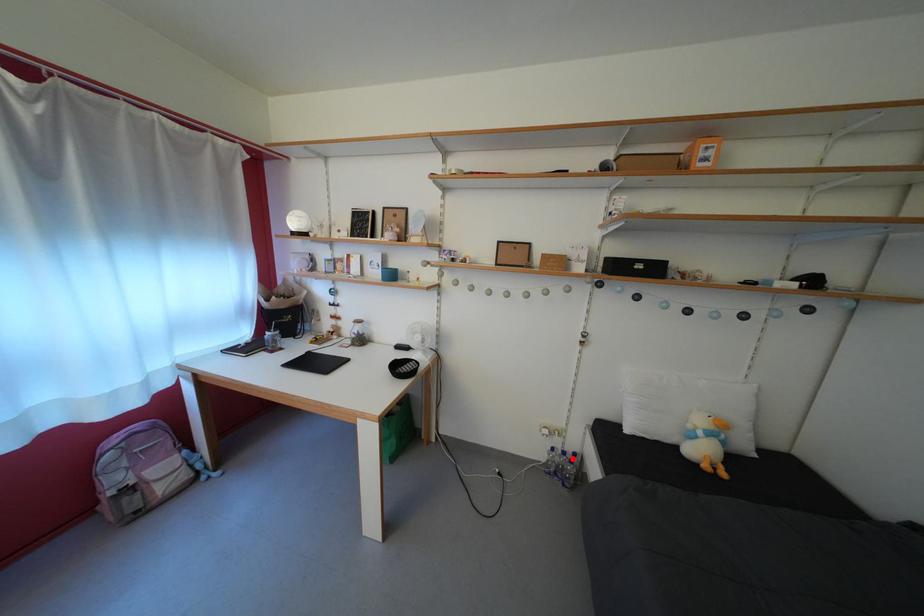
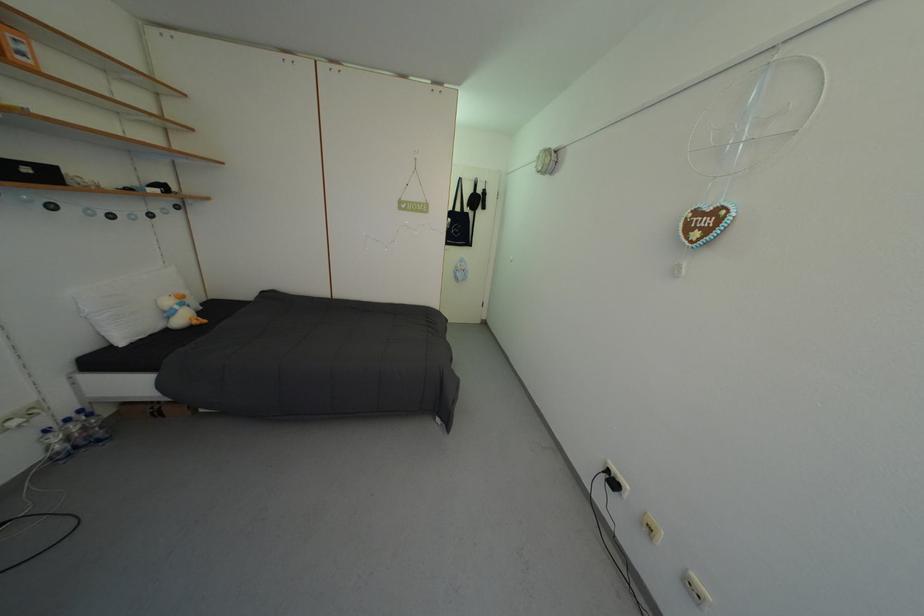
Where in the second image is the point corresponding to the highlighted location from the first image?

(76, 426)